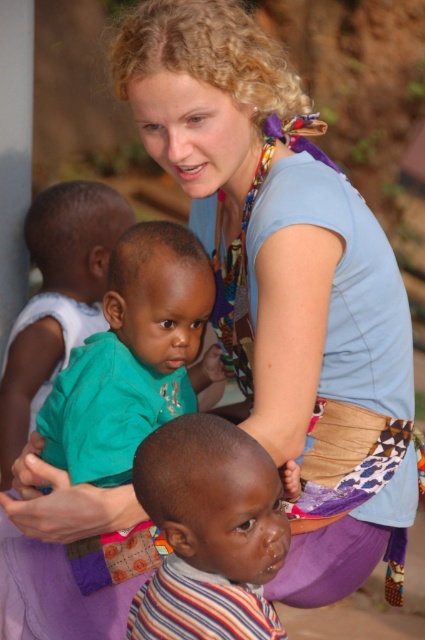
Question: Among these objects, which one is farthest from the camera?

Choices:
 (A) green matte shirt at center
 (B) striped fabric shirt at center

Answer: (A)

Question: Estimate the real-world distances between objects in this image. Which object is closer to the green fabric shirt at center?

Choices:
 (A) green matte shirt at center
 (B) striped fabric shirt at center

Answer: (A)

Question: Is striped fabric shirt at center below green matte shirt at center?

Choices:
 (A) yes
 (B) no

Answer: (A)

Question: Is striped fabric shirt at center to the right of green matte shirt at center from the viewer's perspective?

Choices:
 (A) no
 (B) yes

Answer: (B)

Question: Considering the real-world distances, which object is farthest from the green matte shirt at center?

Choices:
 (A) green fabric shirt at center
 (B) striped fabric shirt at center

Answer: (A)

Question: Where is green matte shirt at center located in relation to green fabric shirt at center in the image?

Choices:
 (A) right
 (B) left

Answer: (A)